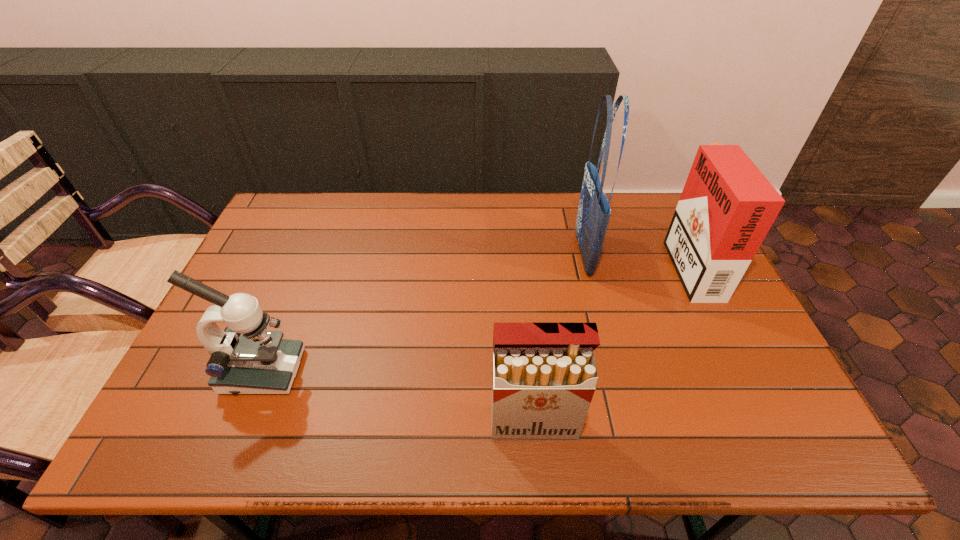
At what (x,y) coordinates should I click in order to perform the action: click on free spot between the right cigarette case and the second object from right to left. Please return your answer as a coordinate pair (x, y). The image size is (960, 540). Looking at the image, I should click on (636, 259).

Locate an element on the screen. The width and height of the screenshot is (960, 540). free space between the third object from left to right and the leftmost object is located at coordinates (422, 313).

What are the coordinates of `unoccupied area between the nearer cigarette case and the right cigarette case` in the screenshot? It's located at (612, 343).

Choose which object is the nearest neighbor to the microscope. Please provide its 2D coordinates. Your answer should be formatted as a tuple, i.e. [(x, y)], where the tuple contains the x and y coordinates of a point satisfying the conditions above.

[(544, 374)]

At what (x,y) coordinates should I click in order to perform the action: click on object that is the closest to the nearer cigarette case. Please return your answer as a coordinate pair (x, y). Looking at the image, I should click on (594, 211).

Where is `free space that satisfies the following two spatial constraints: 1. on the front-facing side of the rightmost object; 2. with the lid open on the nearer cigarette case`? Image resolution: width=960 pixels, height=540 pixels. free space that satisfies the following two spatial constraints: 1. on the front-facing side of the rightmost object; 2. with the lid open on the nearer cigarette case is located at coordinates click(x=768, y=423).

Identify the location of blank space that satisfies the following two spatial constraints: 1. on the front-facing side of the second object from right to left; 2. with the lid open on the left cigarette case. (625, 423).

Find the location of a particular element. vacant space that satisfies the following two spatial constraints: 1. on the front-facing side of the rightmost object; 2. with the lid open on the nearest object is located at coordinates coord(768,423).

The width and height of the screenshot is (960, 540). What are the coordinates of `free space that satisfies the following two spatial constraints: 1. on the front-facing side of the farther cigarette case; 2. with the lid open on the nearest object` in the screenshot? It's located at (768, 423).

Where is `vacant space that satisfies the following two spatial constraints: 1. on the front-facing side of the farther cigarette case; 2. with the lid open on the nearest object`? This screenshot has width=960, height=540. vacant space that satisfies the following two spatial constraints: 1. on the front-facing side of the farther cigarette case; 2. with the lid open on the nearest object is located at coordinates (768, 423).